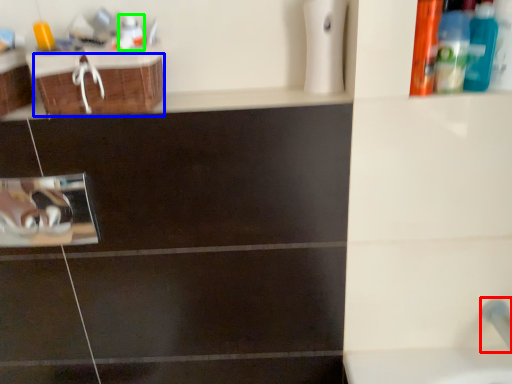
Question: Which is nearer to the plumbing fixture (highlighted by a red box)? drawer (highlighted by a blue box) or mouthwash (highlighted by a green box).

Choices:
 (A) drawer
 (B) mouthwash

Answer: (A)